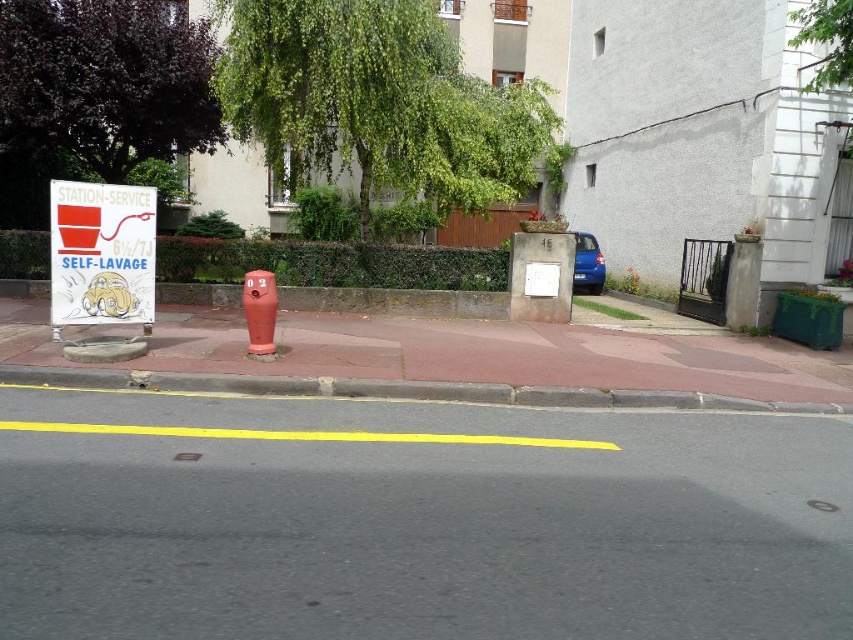
Does point (16, 364) come farther from viewer compared to point (250, 352)?

That is False.

Can you confirm if concrete at center is thinner than matte red hydrant at center?

No, concrete at center is not thinner than matte red hydrant at center.

Is point (62, 374) closer to camera compared to point (268, 320)?

Yes, it is in front of point (268, 320).

The width and height of the screenshot is (853, 640). I want to click on concrete at center, so click(x=398, y=388).

Does concrete at center appear on the left side of red plastic sign at left?

In fact, concrete at center is to the right of red plastic sign at left.

Does concrete at center appear on the right side of red plastic sign at left?

Correct, you'll find concrete at center to the right of red plastic sign at left.

Find the location of a particular element. This screenshot has height=640, width=853. concrete at center is located at coordinates (398, 388).

Find the location of a particular element. concrete at center is located at coordinates (398, 388).

Can you confirm if red plastic sign at left is positioned to the left of matte red hydrant at center?

Indeed, red plastic sign at left is positioned on the left side of matte red hydrant at center.

Can you confirm if red plastic sign at left is thinner than matte red hydrant at center?

No.

Is point (140, 234) positioned in front of point (267, 289)?

That is True.

Locate an element on the screen. The width and height of the screenshot is (853, 640). red plastic sign at left is located at coordinates (102, 253).